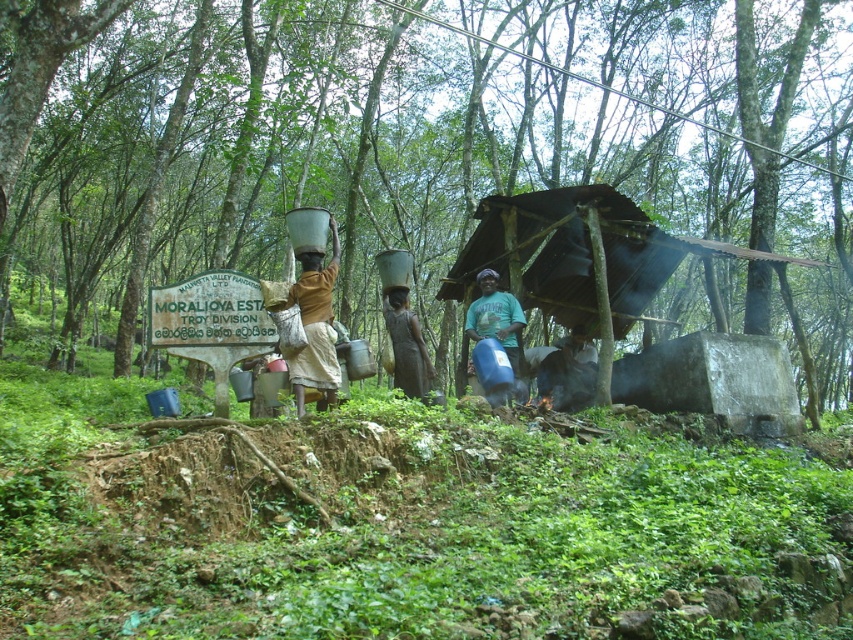
Which is more to the left, brown fabric at center or charcoal gray stone pot at lower center?

brown fabric at center

Does brown fabric at center appear on the left side of charcoal gray stone pot at lower center?

Yes, brown fabric at center is to the left of charcoal gray stone pot at lower center.

Where is `brown fabric at center`? brown fabric at center is located at coordinates (314, 324).

Image resolution: width=853 pixels, height=640 pixels. In order to click on brown fabric at center in this screenshot , I will do `click(314, 324)`.

Is point (590, 396) closer to camera compared to point (469, 314)?

Yes.

Which is behind, point (563, 364) or point (479, 298)?

Point (479, 298)

The width and height of the screenshot is (853, 640). In order to click on charcoal gray stone pot at lower center in this screenshot , I will do `click(566, 371)`.

Is brown fabric at center below brown fabric dress at center?

No, brown fabric at center is not below brown fabric dress at center.

You are a GUI agent. You are given a task and a screenshot of the screen. Output one action in this format:
    pyautogui.click(x=<x>, y=<y>)
    Task: Click on the brown fabric at center
    Image resolution: width=853 pixels, height=640 pixels.
    Given the screenshot: What is the action you would take?
    pyautogui.click(x=314, y=324)

Where is `brown fabric at center`? This screenshot has width=853, height=640. brown fabric at center is located at coordinates (314, 324).